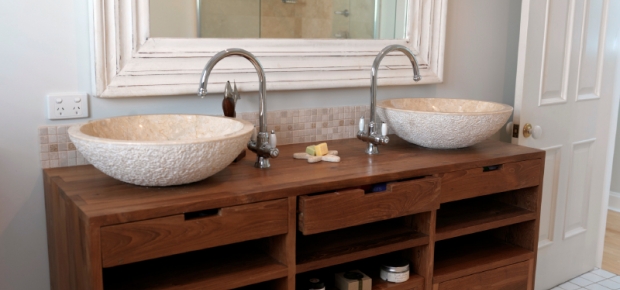
At what (x,y) coordinates should I click in order to perform the action: click on brown hardwood surface. Please return your answer as a coordinate pair (x, y). This screenshot has width=620, height=290. Looking at the image, I should click on (250, 179), (389, 159).